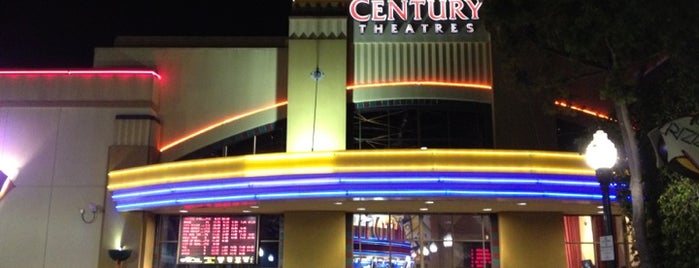
Where is `light bulbs`? The height and width of the screenshot is (268, 699). light bulbs is located at coordinates (428, 247).